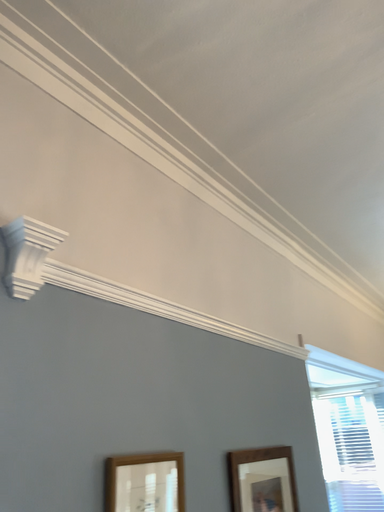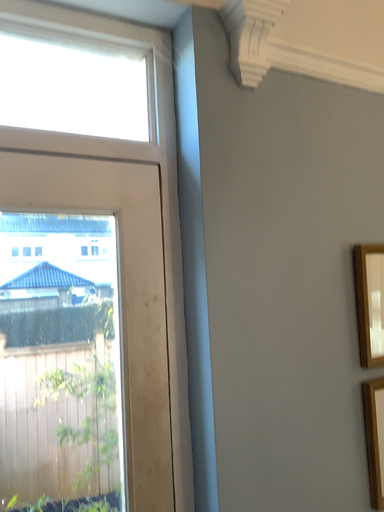
Question: Which way did the camera rotate in the video?

Choices:
 (A) rotated right
 (B) rotated left

Answer: (B)